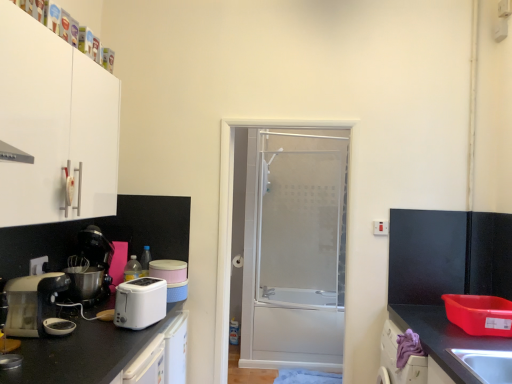
Question: Looking at the image, does purple fabric at lower right seem bigger or smaller compared to matte white toaster at left?

Choices:
 (A) small
 (B) big

Answer: (A)

Question: From a real-world perspective, is purple fabric at lower right above or below matte white toaster at left?

Choices:
 (A) below
 (B) above

Answer: (A)

Question: Which of these objects is positioned closest to the purple fabric at lower right?

Choices:
 (A) white plastic toaster at lower left
 (B) black matte countertop at lower left, which ranks as the 1th countertop in left-to-right order
 (C) matte white toaster at left
 (D) black plastic coffee machine at left
 (E) transparent glass shower door at center

Answer: (A)

Question: Based on their relative distances, which object is nearer to the black matte countertop at lower left, which is the second countertop in right-to-left order?

Choices:
 (A) white plastic electric outlet at lower left
 (B) white matte cabinet at upper left
 (C) matte white toaster at left
 (D) transparent glass shower door at center
 (E) black granite countertop at lower right, arranged as the 2th countertop when viewed from the left

Answer: (C)